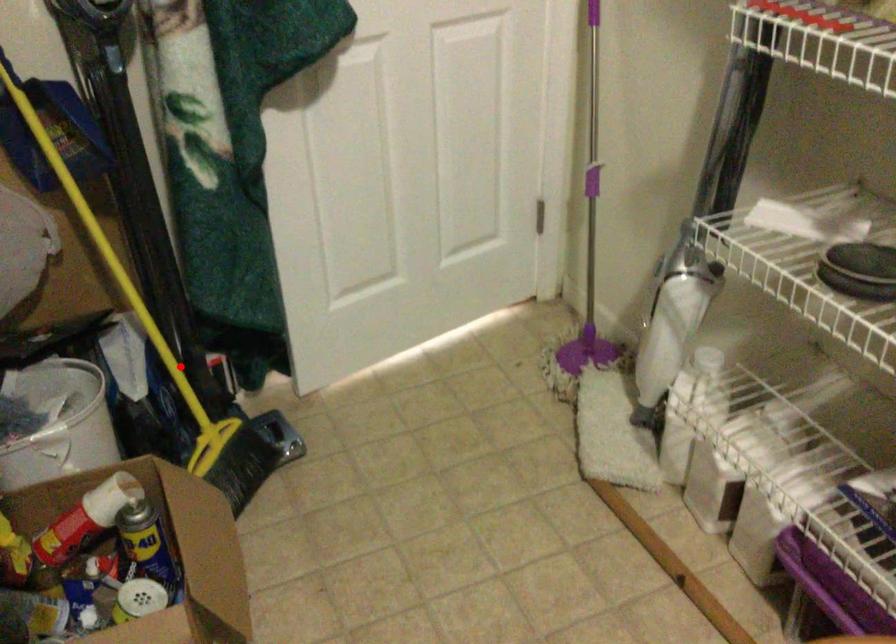
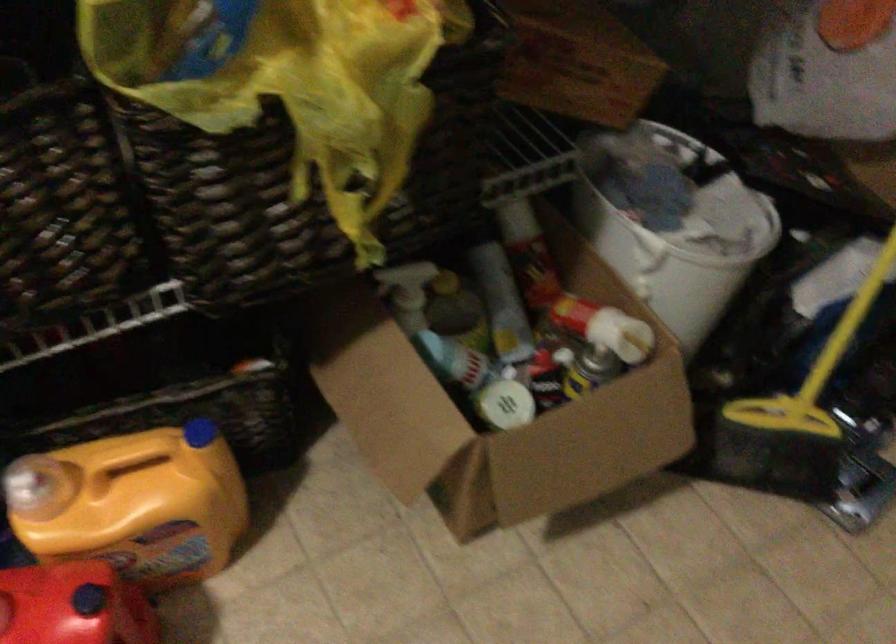
The point at the highlighted location is marked in the first image. Where is the corresponding point in the second image?

(849, 323)